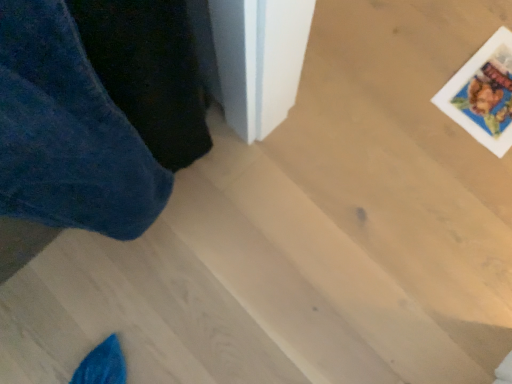
What do you see at coordinates (483, 94) in the screenshot? Image resolution: width=512 pixels, height=384 pixels. I see `printed paper postcard at upper right` at bounding box center [483, 94].

Find the location of a particular element. This screenshot has width=512, height=384. printed paper postcard at upper right is located at coordinates (483, 94).

What are the coordinates of `velvety blue trousers at left` in the screenshot? It's located at (68, 132).

Measure the distance between velvety blue trousers at left and camera.

14.64 inches.

The width and height of the screenshot is (512, 384). Describe the element at coordinates (68, 132) in the screenshot. I see `velvety blue trousers at left` at that location.

What is the approximate width of velvety blue trousers at left?

10.77 inches.

Identify the location of printed paper postcard at upper right. (483, 94).

Considering the relative positions of printed paper postcard at upper right and velvety blue trousers at left in the image provided, is printed paper postcard at upper right to the left or to the right of velvety blue trousers at left?

printed paper postcard at upper right is to the right of velvety blue trousers at left.

Which object is further away from the camera, printed paper postcard at upper right or velvety blue trousers at left?

printed paper postcard at upper right is more distant.

Which point is more forward, [511,46] or [5,125]?

The point [5,125] is more forward.

From the image's perspective, which is above, printed paper postcard at upper right or velvety blue trousers at left?

printed paper postcard at upper right, from the image's perspective.

From a real-world perspective, which object rests below the other?

printed paper postcard at upper right.

Is printed paper postcard at upper right thinner than velvety blue trousers at left?

No.

Can you confirm if printed paper postcard at upper right is taller than velvety blue trousers at left?

Incorrect, the height of printed paper postcard at upper right is not larger of that of velvety blue trousers at left.

Based on their sizes in the image, would you say printed paper postcard at upper right is bigger or smaller than velvety blue trousers at left?

printed paper postcard at upper right is smaller than velvety blue trousers at left.

Is printed paper postcard at upper right positioned beyond the bounds of velvety blue trousers at left?

printed paper postcard at upper right is positioned outside velvety blue trousers at left.

Are printed paper postcard at upper right and velvety blue trousers at left far apart?

They are positioned close to each other.

Is printed paper postcard at upper right oriented away from velvety blue trousers at left?

No, printed paper postcard at upper right's orientation is not away from velvety blue trousers at left.

What's the angular difference between printed paper postcard at upper right and velvety blue trousers at left's facing directions?

They differ by 91.8 degrees in their facing directions.

Where is `postcard located above the velvety blue trousers at left (from the image's perspective)`? postcard located above the velvety blue trousers at left (from the image's perspective) is located at coordinates (483, 94).

Consider the image. Is velvety blue trousers at left to the left of printed paper postcard at upper right from the viewer's perspective?

Yes.

Which is behind, velvety blue trousers at left or printed paper postcard at upper right?

printed paper postcard at upper right is behind.

Which is less distant, (23,35) or (490,74)?

Point (23,35) is closer to the camera than point (490,74).

From the image's perspective, is velvety blue trousers at left over printed paper postcard at upper right?

No, from the image's perspective, velvety blue trousers at left is not above printed paper postcard at upper right.

From a real-world perspective, is velvety blue trousers at left physically above printed paper postcard at upper right?

Indeed, from a real-world perspective, velvety blue trousers at left stands above printed paper postcard at upper right.

Looking at this image, which object is thinner, velvety blue trousers at left or printed paper postcard at upper right?

velvety blue trousers at left.

Between velvety blue trousers at left and printed paper postcard at upper right, which one has more height?

velvety blue trousers at left.

In terms of size, does velvety blue trousers at left appear bigger or smaller than printed paper postcard at upper right?

Clearly, velvety blue trousers at left is larger in size than printed paper postcard at upper right.

Choose the correct answer: Is velvety blue trousers at left inside printed paper postcard at upper right or outside it?

velvety blue trousers at left is outside printed paper postcard at upper right.

Are velvety blue trousers at left and printed paper postcard at upper right making contact?

velvety blue trousers at left and printed paper postcard at upper right are not in contact.

Is velvety blue trousers at left looking in the opposite direction of printed paper postcard at upper right?

velvety blue trousers at left does not have its back to printed paper postcard at upper right.

I want to click on postcard above the velvety blue trousers at left (from the image's perspective), so click(483, 94).

At what (x,y) coordinates should I click in order to perform the action: click on trousers in front of the printed paper postcard at upper right. Please return your answer as a coordinate pair (x, y). Looking at the image, I should click on (68, 132).

I want to click on trousers located below the printed paper postcard at upper right (from the image's perspective), so click(x=68, y=132).